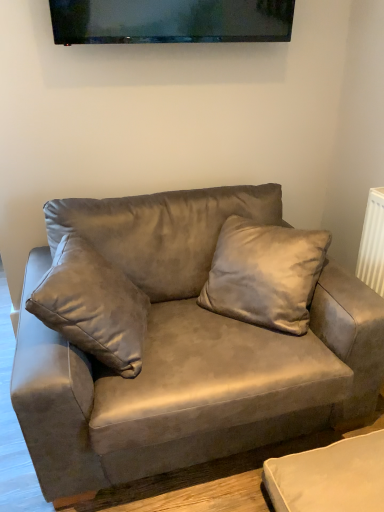
Image resolution: width=384 pixels, height=512 pixels. Describe the element at coordinates (170, 21) in the screenshot. I see `matte black tv at upper center` at that location.

You are a GUI agent. You are given a task and a screenshot of the screen. Output one action in this format:
    pyautogui.click(x=<x>, y=<y>)
    Task: Click on the matte black tv at upper center
    
    Given the screenshot: What is the action you would take?
    pyautogui.click(x=170, y=21)

Who is more distant, suede pillow at center or matte black tv at upper center?

matte black tv at upper center is behind.

Is suede pillow at center spatially inside matte black tv at upper center, or outside of it?

suede pillow at center is not inside matte black tv at upper center, it's outside.

Is suede pillow at center next to matte black tv at upper center?

No, suede pillow at center is not next to matte black tv at upper center.

Considering the sizes of objects suede pillow at center and suede gray couch at center in the image provided, who is bigger, suede pillow at center or suede gray couch at center?

suede gray couch at center.

Is suede pillow at center surrounding suede gray couch at center?

No.

Considering the positions of objects suede pillow at center and suede gray couch at center in the image provided, who is more to the left, suede pillow at center or suede gray couch at center?

From the viewer's perspective, suede gray couch at center appears more on the left side.

Considering the positions of objects suede pillow at center and suede gray couch at center in the image provided, who is behind, suede pillow at center or suede gray couch at center?

suede pillow at center is further away from the camera.

Identify the location of television on the left of suede pillow at center. This screenshot has height=512, width=384. (170, 21).

Is matte black tv at upper center positioned before suede pillow at center?

No, matte black tv at upper center is further to the viewer.

Which is behind, point (176, 5) or point (229, 253)?

The point (229, 253) is behind.

Are matte black tv at upper center and suede pillow at center located far from each other?

They are positioned close to each other.

Which of these two, matte black tv at upper center or suede gray couch at center, is bigger?

Bigger between the two is suede gray couch at center.

Is point (170, 23) closer or farther from the camera than point (370, 347)?

Point (170, 23).

Based on the photo, from a real-world perspective, does matte black tv at upper center sit lower than suede gray couch at center?

Actually, matte black tv at upper center is physically above suede gray couch at center in the real world.

In terms of height, does matte black tv at upper center look taller or shorter compared to suede gray couch at center?

Considering their sizes, matte black tv at upper center has less height than suede gray couch at center.

In the scene shown: Does suede gray couch at center appear on the left side of matte black tv at upper center?

In fact, suede gray couch at center is to the right of matte black tv at upper center.

Locate an element on the screen. Image resolution: width=384 pixels, height=512 pixels. studio couch below the matte black tv at upper center (from the image's perspective) is located at coordinates (185, 351).

Consider the image. From a real-world perspective, who is located lower, suede gray couch at center or matte black tv at upper center?

suede gray couch at center is physically lower.

From the image's perspective, which one is positioned higher, suede gray couch at center or suede pillow at center?

suede pillow at center.

Does suede gray couch at center lie in front of suede pillow at center?

Yes, it is in front of suede pillow at center.

I want to click on studio couch on the left of suede pillow at center, so click(x=185, y=351).

Find the location of a particular element. The image size is (384, 512). television lying behind the suede pillow at center is located at coordinates (170, 21).

This screenshot has height=512, width=384. I want to click on studio couch to the left of suede pillow at center, so click(185, 351).

Considering their positions, is suede gray couch at center positioned closer to matte black tv at upper center than suede pillow at center?

Among the two, suede pillow at center is located nearer to matte black tv at upper center.

Based on the photo, considering their positions, is suede pillow at center positioned closer to suede gray couch at center than matte black tv at upper center?

Based on the image, suede pillow at center appears to be nearer to suede gray couch at center.

When comparing their distances from suede pillow at center, does suede gray couch at center or matte black tv at upper center seem further?

Among the two, matte black tv at upper center is located further to suede pillow at center.

Which object lies further to the anchor point suede gray couch at center, matte black tv at upper center or suede pillow at center?

Based on the image, matte black tv at upper center appears to be further to suede gray couch at center.

Based on the photo, looking at the image, which one is located closer to suede pillow at center, matte black tv at upper center or suede gray couch at center?

suede gray couch at center.

From the picture: Looking at the image, which one is located further to matte black tv at upper center, suede pillow at center or suede gray couch at center?

Based on the image, suede gray couch at center appears to be further to matte black tv at upper center.

Where is `pillow between matte black tv at upper center and suede gray couch at center from top to bottom`? The height and width of the screenshot is (512, 384). pillow between matte black tv at upper center and suede gray couch at center from top to bottom is located at coordinates (265, 274).